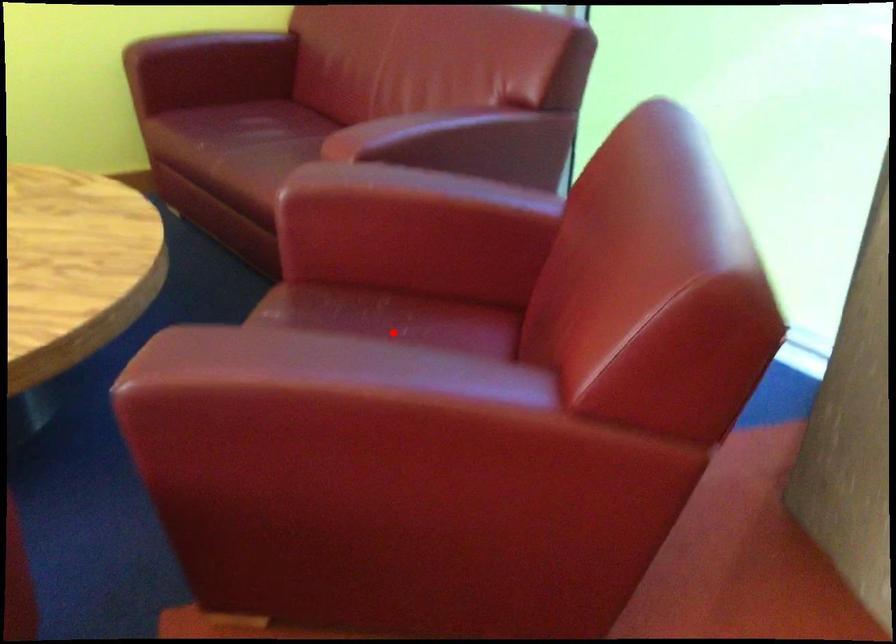
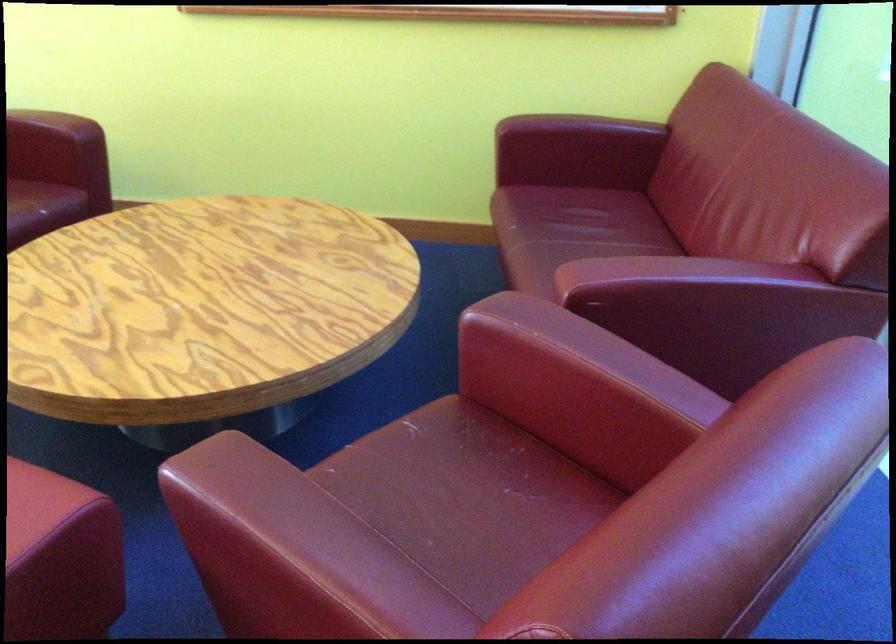
The point at the highlighted location is marked in the first image. Where is the corresponding point in the second image?

(479, 488)